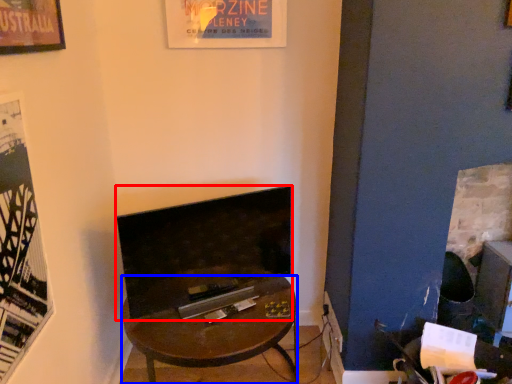
Question: Which point is closer to the camera, fireplace (highlighted by a red box) or desk (highlighted by a blue box)?

Choices:
 (A) fireplace
 (B) desk

Answer: (B)